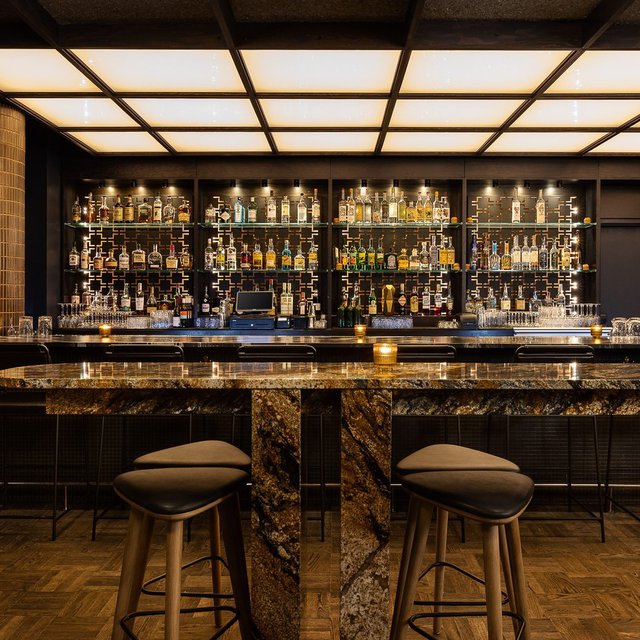
Where is `barstools`? barstools is located at coordinates (555, 352), (422, 352), (272, 351), (140, 348), (22, 352), (474, 499), (448, 457), (217, 451), (185, 486).